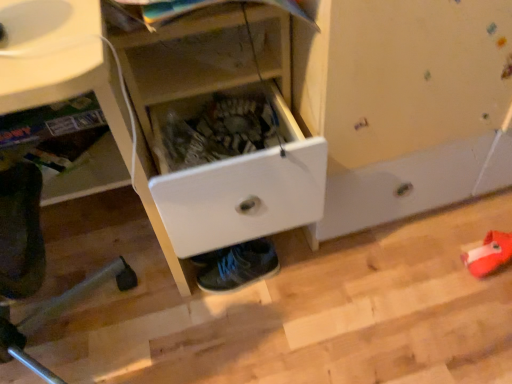
Locate an element on the screen. vacant area that lies to the right of white plastic drawer at center is located at coordinates (365, 269).